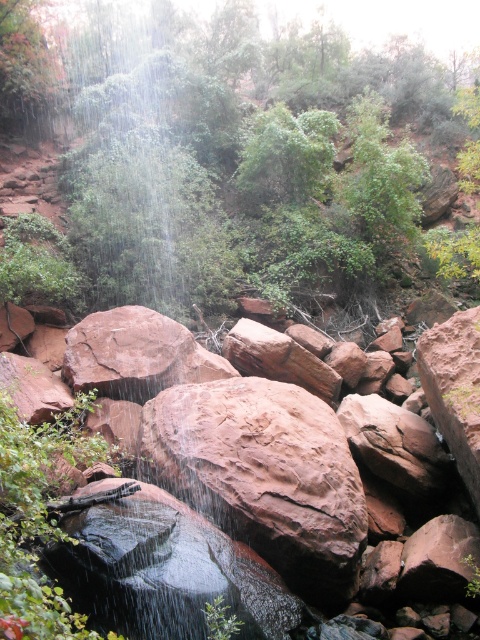
You are a geologist examining the rocky landscape. You notice the rusty rock at center and the green mossy rock at upper left. Which rock takes up more area in the image?

The green mossy rock at upper left occupies more space than the rusty rock at center according to the description.

You are a hiker trying to navigate through the rocky terrain. You see the rusty rock at center and the green mossy rock at upper left. Which rock is closer to you?

The rusty rock at center is closer to you because it is positioned in front of the green mossy rock at upper left.

You are a hiker trying to navigate the rocky terrain in the image. You need to step on the rusty rock at center and the green mossy rock at upper left. Which rock should you step on first to reach the higher elevation?

The green mossy rock at upper left is taller than the rusty rock at center, so you should step on the green mossy rock at upper left first to reach the higher elevation.